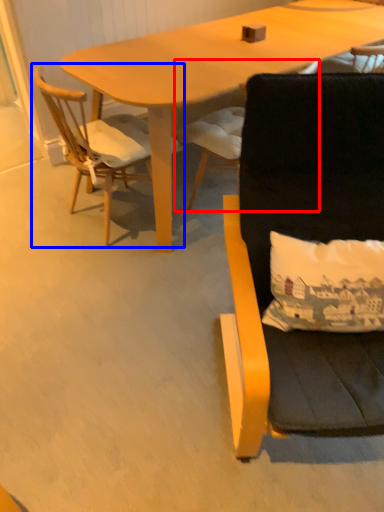
Question: Which object appears closest to the camera in this image, chair (highlighted by a red box) or chair (highlighted by a blue box)?

Choices:
 (A) chair
 (B) chair

Answer: (B)